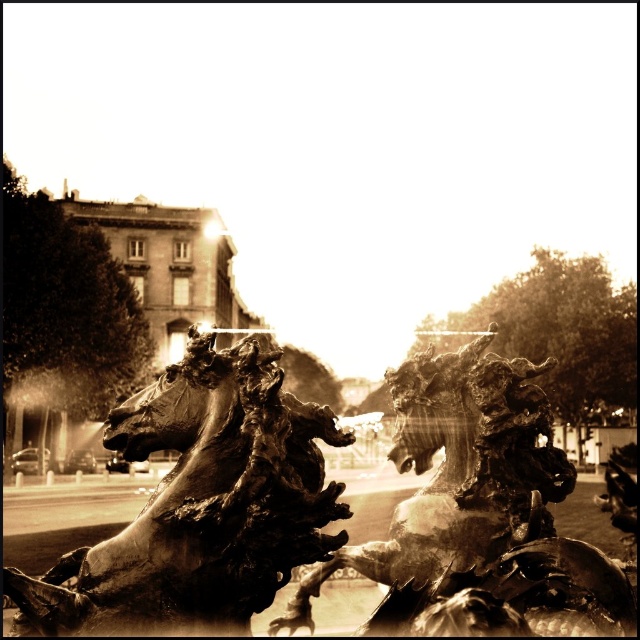
Is bronze horse at center below bronze dragon at center?

Incorrect, bronze horse at center is not positioned below bronze dragon at center.

Is point (216, 468) less distant than point (472, 579)?

No, it is not.

This screenshot has height=640, width=640. Identify the location of bronze horse at center. (200, 504).